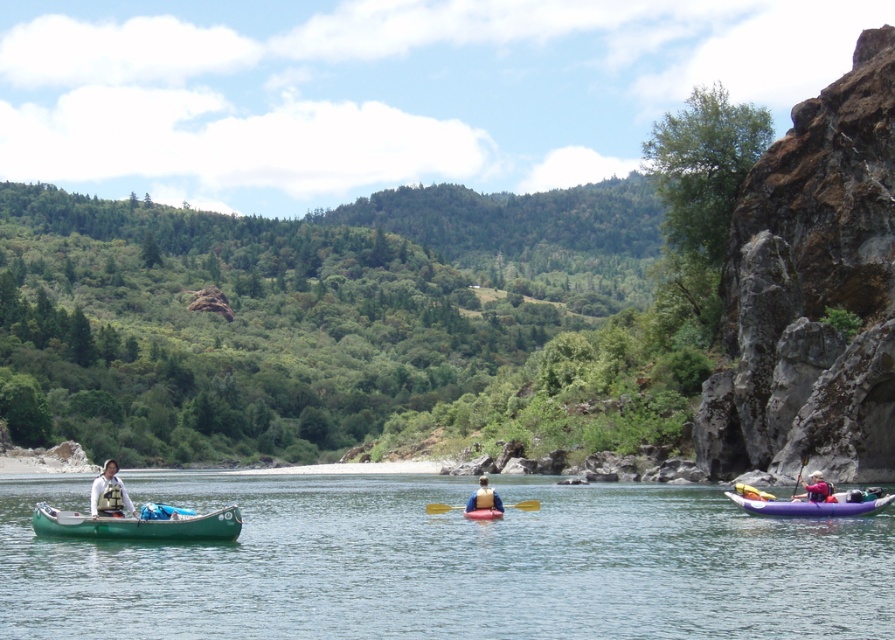
You are navigating a kayak and want to reach a destination marked by point A at point (237, 515) and point B at point (864, 512). Which point should you aim for first to ensure you follow the correct path?

You should aim for point A at point (237, 515) first because it is in front of point B at point (864, 512).

You are standing on the riverbank and want to retrieve your kayak. You have a matte pink kayak at right and a rubber kayak at center. Which one is physically nearer to you?

The matte pink kayak at right is closer to the viewer than the rubber kayak at center, so the matte pink kayak at right is physically nearer to you.

Looking at this image, you are a photographer standing at the point labeled as point (813, 506). You want to capture a photo of the purple inflatable kayak at right. Which direction should you move to get a better shot?

The point (813, 506) indicates the purple inflatable kayak at right, so you are already positioned at the location of the kayak. To get a better shot, you should move slightly back or adjust your angle to frame the kayak properly.